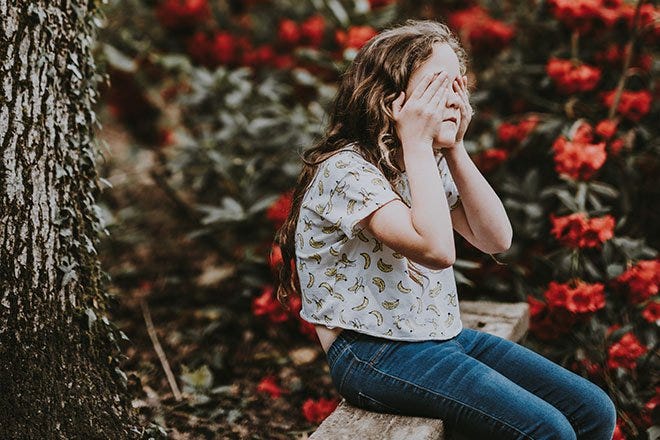
You are a GUI agent. You are given a task and a screenshot of the screen. Output one action in this format:
    pyautogui.click(x=<x>, y=<y>)
    Task: Click on the bench
    The height and width of the screenshot is (440, 660).
    Given the screenshot: What is the action you would take?
    pyautogui.click(x=378, y=425)